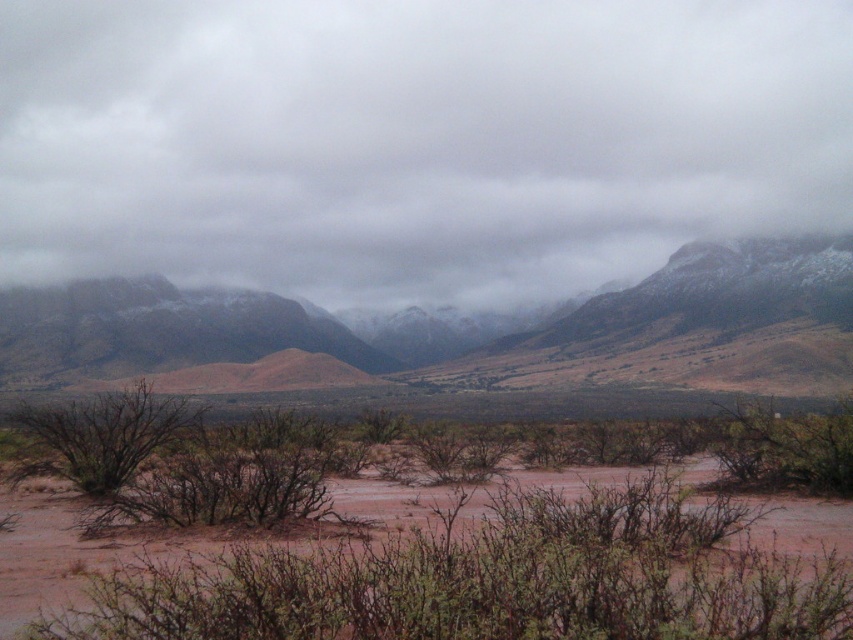
You are an astronaut stranded in a desert and need to signal for help. You have a mirror and can reflect sunlight towards the cloudy gray sky at upper center or the brown dry bush at lower left. Which object should you aim for to maximize visibility of your signal?

You should aim the mirror at the cloudy gray sky at upper center because it is larger in size than the brown dry bush at lower left, making it easier to hit and more visible from a distance.